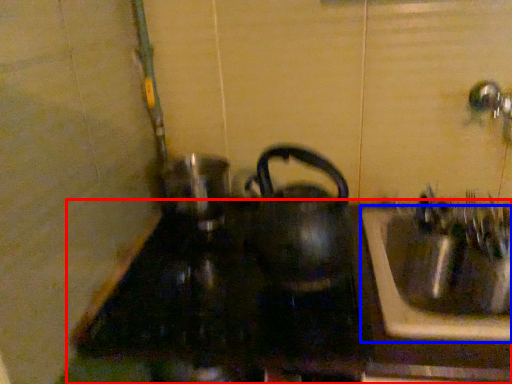
Question: Among these objects, which one is farthest to the camera, counter top (highlighted by a red box) or sink (highlighted by a blue box)?

Choices:
 (A) counter top
 (B) sink

Answer: (B)